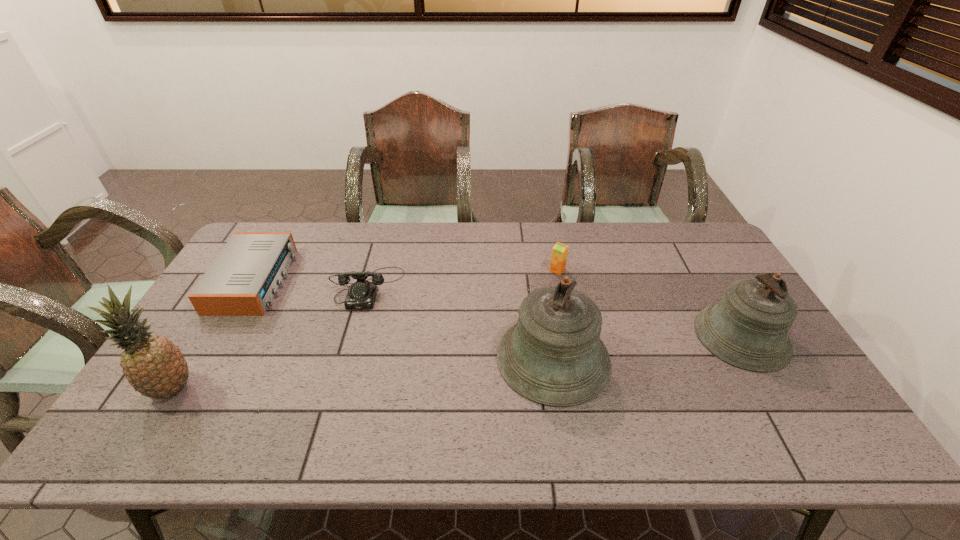
Where is `blank region between the pineapple and the left bell`? This screenshot has height=540, width=960. blank region between the pineapple and the left bell is located at coordinates (363, 374).

At what (x,y) coordinates should I click in order to perform the action: click on vacant area that lies between the radio receiver and the rightmost object. Please return your answer as a coordinate pair (x, y). Image resolution: width=960 pixels, height=540 pixels. Looking at the image, I should click on (498, 308).

Find the location of a particular element. Image resolution: width=960 pixels, height=540 pixels. empty space that is in between the radio receiver and the left bell is located at coordinates (404, 319).

Identify the location of vacant point located between the left bell and the rightmost object. This screenshot has height=540, width=960. (647, 347).

Where is `free space between the radio receiver and the fourth object from right to left`? free space between the radio receiver and the fourth object from right to left is located at coordinates (311, 284).

Find the location of a particular element. The height and width of the screenshot is (540, 960). the third closest object to the radio receiver is located at coordinates (553, 355).

Identify the location of the fourth closest object to the telephone. This screenshot has height=540, width=960. (560, 251).

The height and width of the screenshot is (540, 960). Find the location of `vacant space that satisfies the following two spatial constraints: 1. on the front panel of the third tallest object; 2. on the left side of the radio receiver`. vacant space that satisfies the following two spatial constraints: 1. on the front panel of the third tallest object; 2. on the left side of the radio receiver is located at coordinates (222, 336).

You are a GUI agent. You are given a task and a screenshot of the screen. Output one action in this format:
    pyautogui.click(x=<x>, y=<y>)
    Task: Click on the vacant space that satisfies the following two spatial constraints: 1. on the front-facing side of the taller bell; 2. on the right side of the telephone
    
    Given the screenshot: What is the action you would take?
    pyautogui.click(x=347, y=358)

You are a GUI agent. You are given a task and a screenshot of the screen. Output one action in this format:
    pyautogui.click(x=<x>, y=<y>)
    Task: Click on the free point that satisfies the following two spatial constraints: 1. on the front-facing side of the third object from left to right; 2. on the left side of the right bell
    
    Given the screenshot: What is the action you would take?
    pyautogui.click(x=353, y=336)